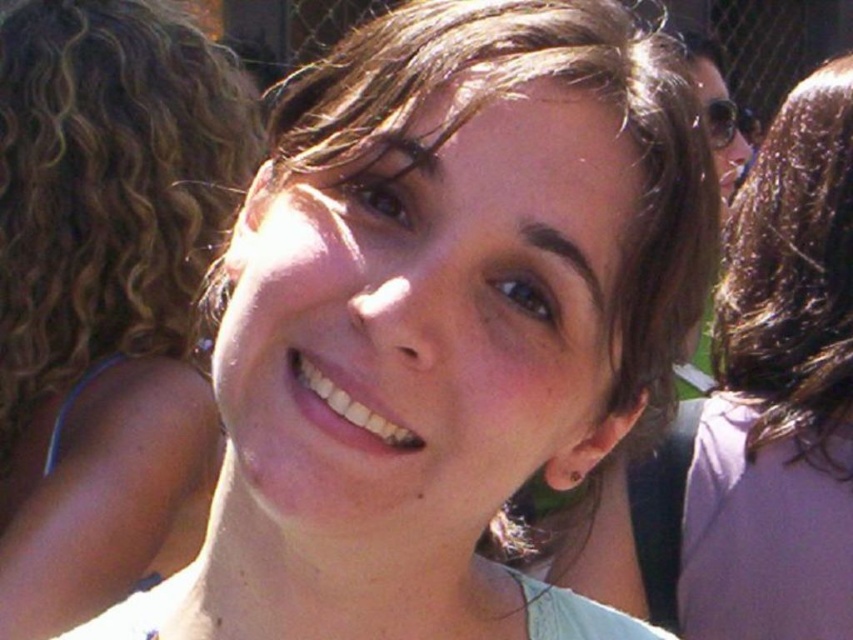
Question: Considering the real-world distances, which object is farthest from the matte skin at center?

Choices:
 (A) smooth brown hair at center
 (B) brown shiny hair at center

Answer: (A)

Question: Which object is positioned closest to the brown shiny hair at center?

Choices:
 (A) matte skin at center
 (B) smooth brown hair at center

Answer: (B)

Question: In this image, where is matte skin at center located relative to brown shiny hair at center?

Choices:
 (A) right
 (B) left

Answer: (B)

Question: Can you confirm if matte skin at center is bigger than smooth brown hair at center?

Choices:
 (A) yes
 (B) no

Answer: (A)

Question: Which point is closer to the camera?

Choices:
 (A) matte skin at center
 (B) brown shiny hair at center
 (C) smooth brown hair at center

Answer: (B)

Question: Does matte skin at center appear over smooth brown hair at center?

Choices:
 (A) no
 (B) yes

Answer: (B)